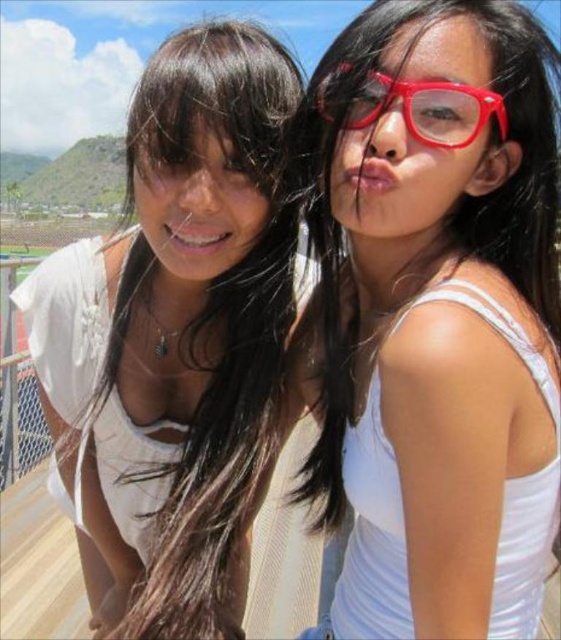
Question: Which of the following is the closest to the observer?

Choices:
 (A) (148, 458)
 (B) (370, 90)

Answer: (B)

Question: Among these points, which one is nearest to the camera?

Choices:
 (A) (213, 401)
 (B) (374, 88)
 (C) (508, 196)

Answer: (C)

Question: Which point appears closest to the camera in this image?

Choices:
 (A) (358, 118)
 (B) (128, 332)

Answer: (A)

Question: Does matte white tank top at center appear on the right side of white matte tank top at left?

Choices:
 (A) no
 (B) yes

Answer: (B)

Question: Does white matte tank top at left appear over shiny plastic glasses at upper right?

Choices:
 (A) no
 (B) yes

Answer: (A)

Question: Is matte white tank top at center positioned behind shiny plastic glasses at upper right?

Choices:
 (A) yes
 (B) no

Answer: (B)